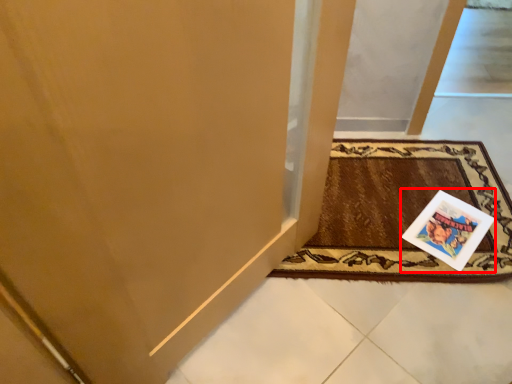
Question: From the image's perspective, what is the correct spatial positioning of postcard (annotated by the red box) in reference to mat?

Choices:
 (A) above
 (B) below

Answer: (B)